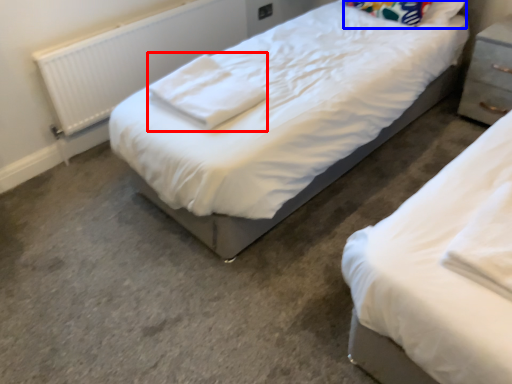
Question: Which object appears farthest to the camera in this image, cloth (highlighted by a red box) or pillow (highlighted by a blue box)?

Choices:
 (A) cloth
 (B) pillow

Answer: (B)